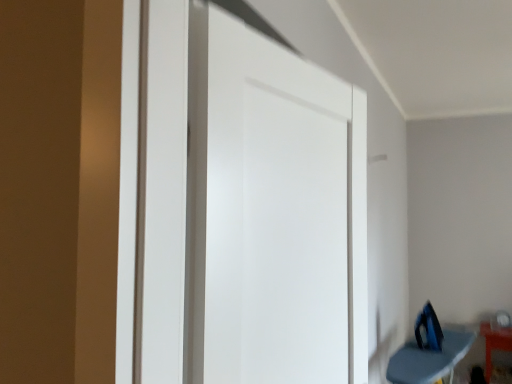
Question: Is blue fabric ironing board at lower right, the first furniture from the left, taller or shorter than orange glossy table at lower right, which is the 1th furniture from back to front?

Choices:
 (A) short
 (B) tall

Answer: (A)

Question: Is blue fabric ironing board at lower right, which ranks as the second furniture in back-to-front order, inside the boundaries of orange glossy table at lower right, which is the 1th furniture from back to front, or outside?

Choices:
 (A) outside
 (B) inside

Answer: (A)

Question: Estimate the real-world distances between objects in this image. Which object is closer to the blue plastic iron at lower right?

Choices:
 (A) blue fabric ironing board at lower right, acting as the first furniture starting from the front
 (B) orange glossy table at lower right, the first furniture positioned from the right
 (C) white matte door at center

Answer: (A)

Question: Which of these objects is positioned closest to the blue fabric ironing board at lower right, the first furniture from the left?

Choices:
 (A) blue plastic iron at lower right
 (B) orange glossy table at lower right, the first furniture positioned from the right
 (C) white matte door at center

Answer: (A)